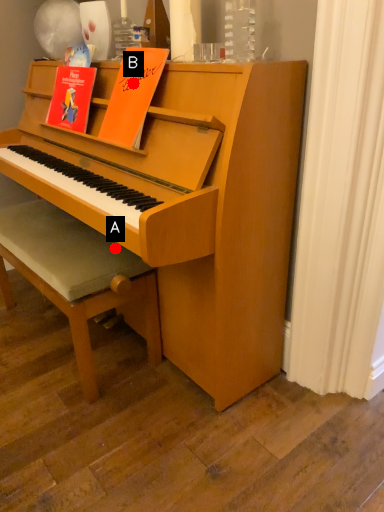
Question: Two points are circled on the image, labeled by A and B beside each circle. Which point is closer to the camera?

Choices:
 (A) A is closer
 (B) B is closer

Answer: (B)